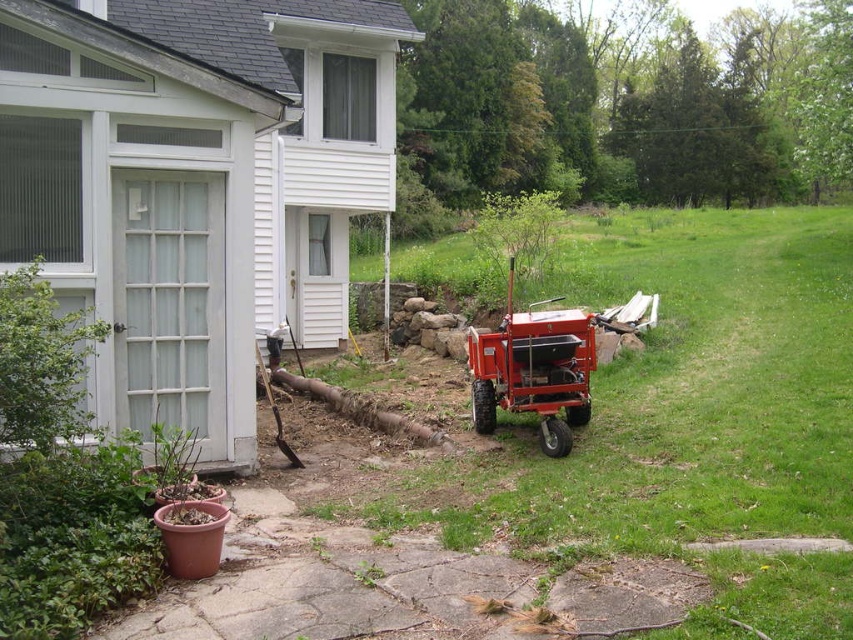
Question: From the image, what is the correct spatial relationship of green grass at center in relation to orange metallic tractor at center?

Choices:
 (A) left
 (B) right

Answer: (B)

Question: Does green grass at center have a greater width compared to orange metallic tractor at center?

Choices:
 (A) no
 (B) yes

Answer: (B)

Question: Which of the following is the farthest from the observer?

Choices:
 (A) (753, 440)
 (B) (627, 301)

Answer: (B)

Question: Considering the relative positions of green grass at center and orange metallic tractor at center in the image provided, where is green grass at center located with respect to orange metallic tractor at center?

Choices:
 (A) left
 (B) right

Answer: (B)